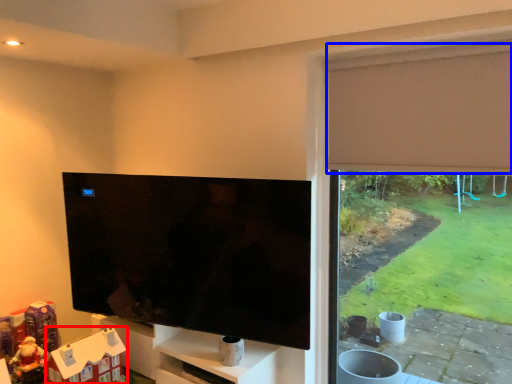
Question: Which of the following is the farthest to the observer, toy (highlighted by a red box) or curtain (highlighted by a blue box)?

Choices:
 (A) toy
 (B) curtain

Answer: (A)